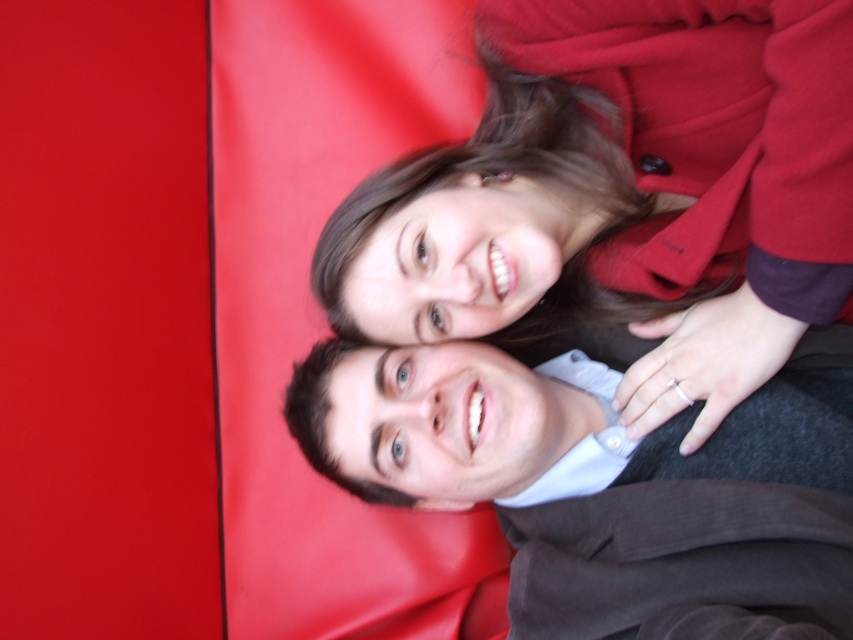
You are a fashion designer analyzing the image. You need to determine which item of clothing has a taller silhouette between the matte red coat at upper center and the smooth brown jacket at lower right. Which one is taller?

The matte red coat at upper center has a greater height compared to the smooth brown jacket at lower right, so the matte red coat at upper center is taller.